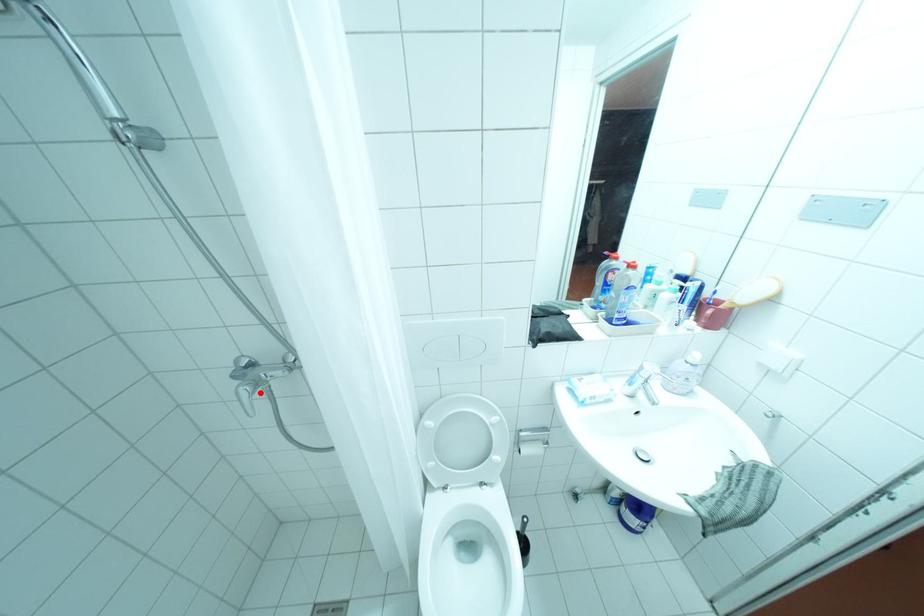
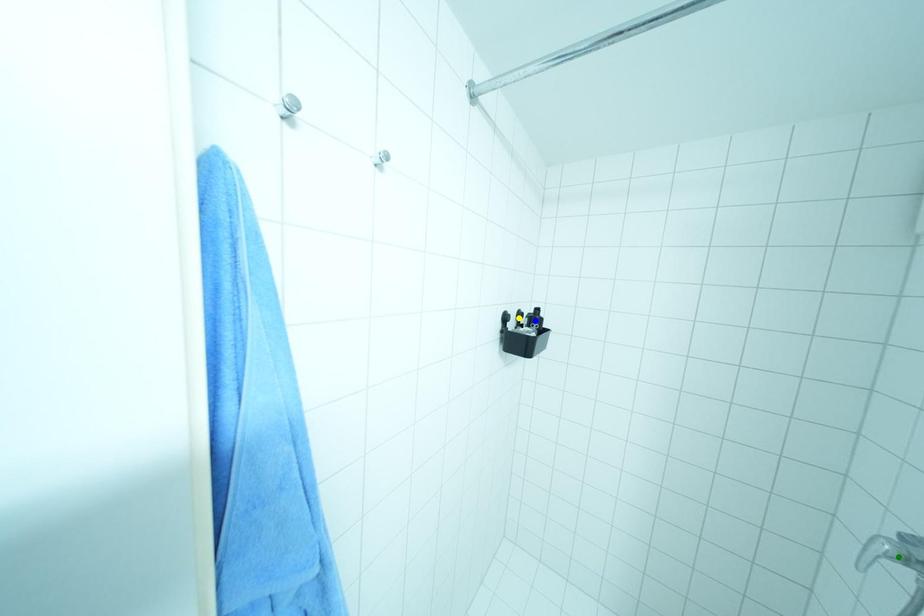
Question: I am providing you with two images of the same scene from different viewpoints. A red point is marked on the first image. You are given multiple points on the second image. Which point in image 2 is actually the same real-world point as the red point in image 1?

Choices:
 (A) yellow point
 (B) green point
 (C) blue point

Answer: (B)